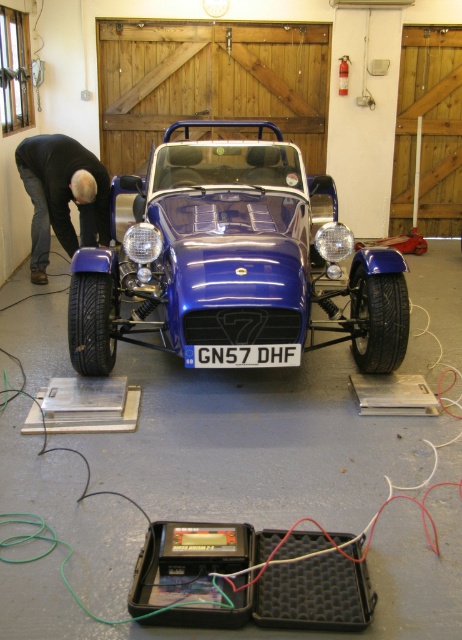
Consider the image. You are a photographer standing at the camera position. You need to take a photo of the glossy blue car at center. The camera has a maximum focus range of 10 feet. Will you be able to focus on the car?

The glossy blue car at center and camera are 11.11 feet apart. Since the camera can only focus up to 10 feet, you won be able to focus on the car.

You are a mechanic working in the workshop. You need to move a tool from the dark blue jeans at left to the black plastic license plate at center. The tool is 3 meters long. Will the tool fit in the space between them without bending?

The distance between the dark blue jeans at left and the black plastic license plate at center is 2.69 meters. Since the tool is 3 meters long, it is longer than the available space. Therefore, the tool will not fit without bending.

You are a mechanic in a workshop. You need to access the tools located on the floor near the dark blue jeans at left. The glossy blue car at center is blocking your path. Can you walk around the car to reach the jeans?

The glossy blue car at center is in front of the dark blue jeans at left, so you can walk around the car to reach the jeans since the car is positioned in the center and the jeans are on the left side.